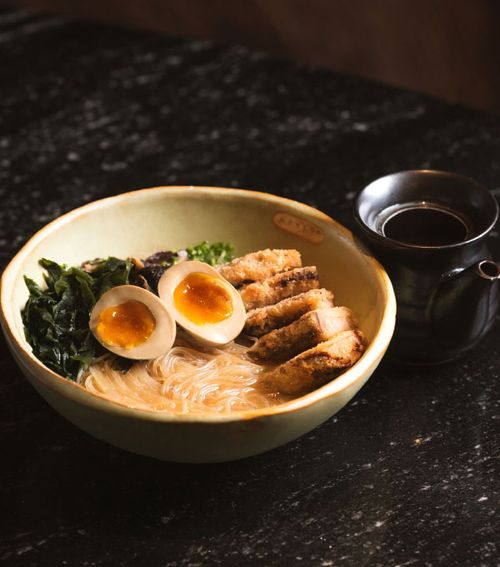
Find the location of `table`. table is located at coordinates (396, 393).